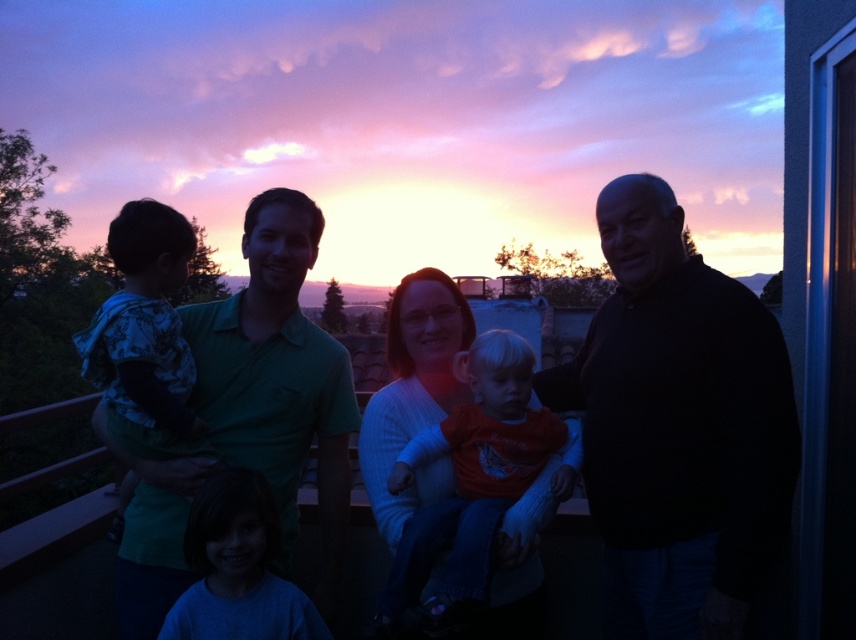
Question: Can you confirm if green cotton shirt at left is positioned to the right of camouflage fabric shirt at left?

Choices:
 (A) yes
 (B) no

Answer: (A)

Question: Which point is closer to the camera?

Choices:
 (A) matte green shirt at left
 (B) green cotton shirt at left
 (C) orange cotton shirt at center

Answer: (A)

Question: Does green cotton shirt at left appear on the left side of camouflage fabric shirt at left?

Choices:
 (A) no
 (B) yes

Answer: (A)

Question: Which object appears farthest from the camera in this image?

Choices:
 (A) matte green shirt at left
 (B) blue cotton shirt at lower left
 (C) camouflage fabric shirt at left

Answer: (C)

Question: Does orange cotton shirt at center lie behind blue cotton shirt at lower left?

Choices:
 (A) no
 (B) yes

Answer: (A)

Question: Which of the following is the closest to the observer?

Choices:
 (A) (651, 358)
 (B) (191, 237)
 (C) (710, 636)

Answer: (C)